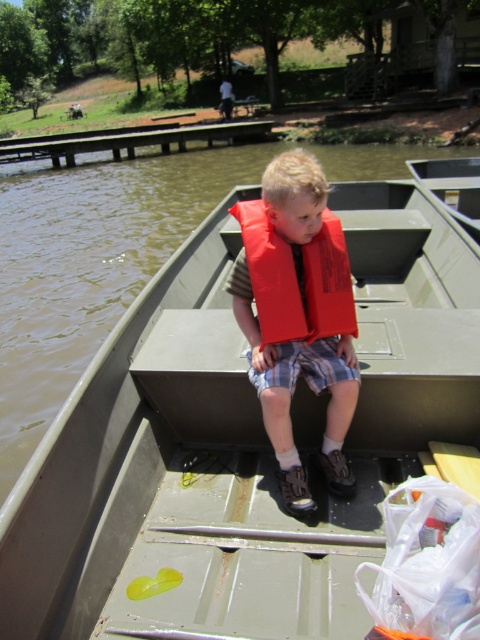
Question: Which object is farther from the camera taking this photo?

Choices:
 (A) metallic gray boat at center
 (B) matte orange life vest at center

Answer: (B)

Question: Can you confirm if matte orange life vest at center is positioned to the left of red matte life jacket at center?

Choices:
 (A) yes
 (B) no

Answer: (A)

Question: Which point appears farthest from the camera in this image?

Choices:
 (A) (343, 298)
 (B) (432, 413)

Answer: (B)

Question: Does metallic gray boat at center have a lesser width compared to matte orange life vest at center?

Choices:
 (A) no
 (B) yes

Answer: (A)

Question: Which point is closer to the camera taking this photo?

Choices:
 (A) (335, 324)
 (B) (391, 333)
 (C) (320, 232)

Answer: (C)

Question: From the image, what is the correct spatial relationship of metallic gray boat at center in relation to matte orange life vest at center?

Choices:
 (A) below
 (B) above

Answer: (B)